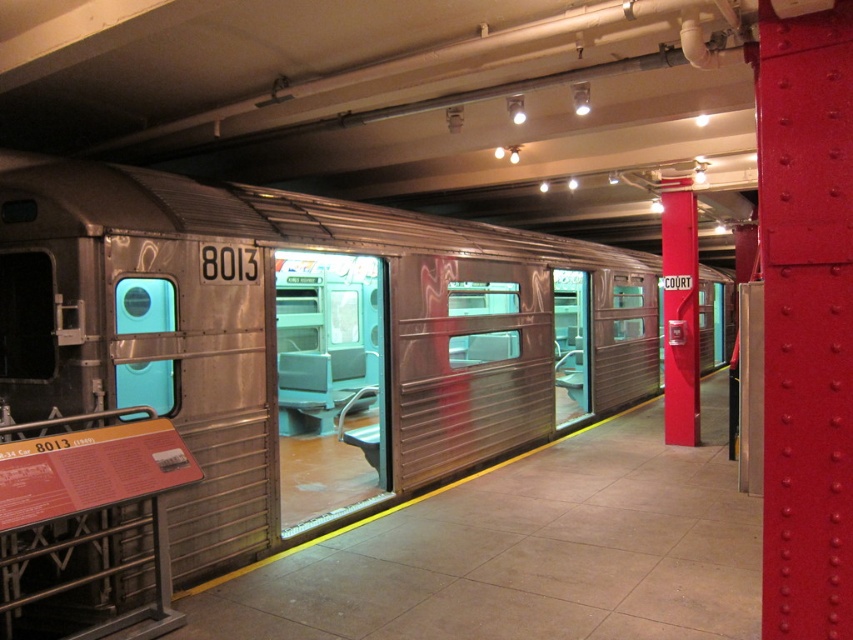
Looking at this image, does smooth red pillar at center right appear over teal plastic door at center?

No.

Can you confirm if smooth red pillar at center right is positioned to the left of teal plastic door at center?

In fact, smooth red pillar at center right is to the right of teal plastic door at center.

Image resolution: width=853 pixels, height=640 pixels. What do you see at coordinates (680, 314) in the screenshot?
I see `smooth red pillar at center right` at bounding box center [680, 314].

This screenshot has width=853, height=640. In order to click on smooth red pillar at center right in this screenshot , I will do `click(680, 314)`.